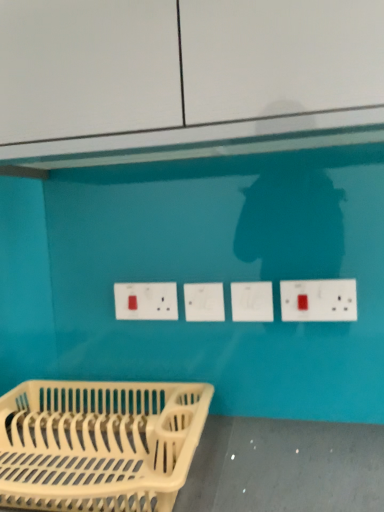
Question: Would you say white plastic socket at center, arranged as the 1th socket when viewed from the left, is to the left or to the right of white plastic socket at center, which is the 2th socket in left-to-right order, in the picture?

Choices:
 (A) right
 (B) left

Answer: (B)

Question: Considering the positions of white plastic socket at center, arranged as the 1th socket when viewed from the left, and white plastic socket at center, which is the 2th socket in left-to-right order, in the image, is white plastic socket at center, arranged as the 1th socket when viewed from the left, taller or shorter than white plastic socket at center, which is the 2th socket in left-to-right order,?

Choices:
 (A) tall
 (B) short

Answer: (A)

Question: Based on their relative distances, which object is nearer to the white plastic electrical outlet at center, marked as the second electric outlet in a right-to-left arrangement?

Choices:
 (A) white plastic socket at center, the 1th socket viewed from the right
 (B) white plastic socket at center, the 2th socket positioned from the right
 (C) white plastic dish rack at lower left
 (D) white plastic electric outlet at right, the 2th electric outlet viewed from the back

Answer: (B)

Question: Considering the real-world distances, which object is farthest from the white plastic electrical outlet at center, marked as the second electric outlet in a right-to-left arrangement?

Choices:
 (A) white plastic socket at center, arranged as the 1th socket when viewed from the left
 (B) white plastic socket at center, which is the 2th socket in left-to-right order
 (C) white plastic dish rack at lower left
 (D) white plastic electric outlet at right, the first electric outlet viewed from the front

Answer: (D)